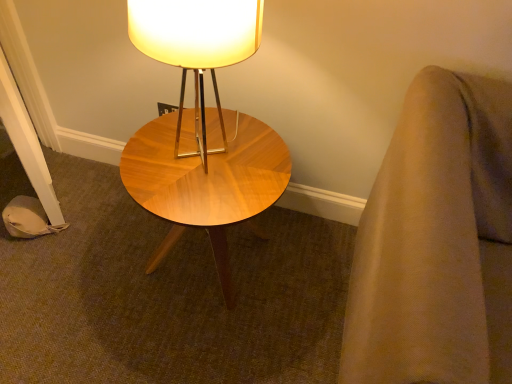
At what (x,y) coordinates should I click in order to perform the action: click on spots to the right of woodenwoodencoffee table at center. Please return your answer as a coordinate pair (x, y). The height and width of the screenshot is (384, 512). Looking at the image, I should click on (307, 266).